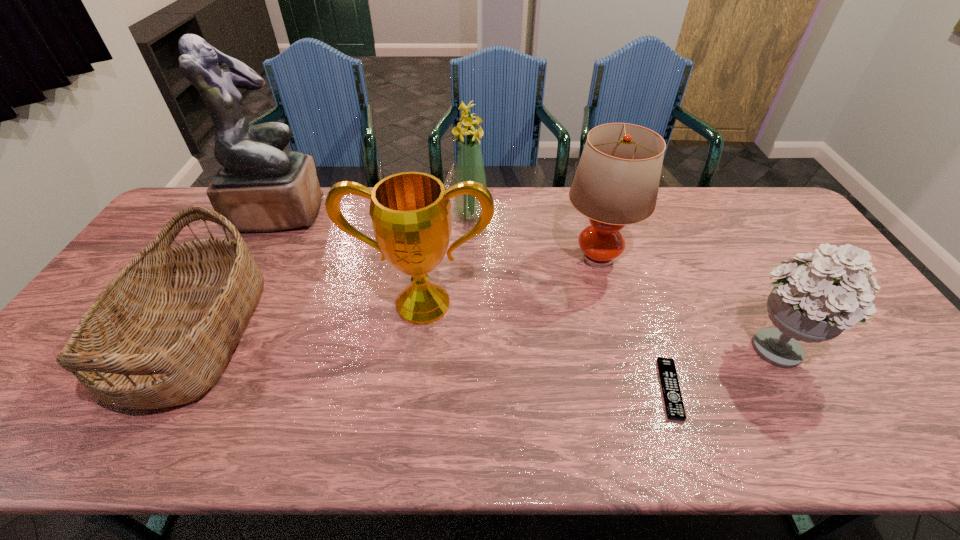
Image resolution: width=960 pixels, height=540 pixels. What are the coordinates of `free space that satisfies the following two spatial constraints: 1. in a relaxed pose on the sculpture; 2. on the right side of the remote control` in the screenshot? It's located at (185, 389).

Locate an element on the screen. Image resolution: width=960 pixels, height=540 pixels. free space that satisfies the following two spatial constraints: 1. on the front-facing side of the taller bouquet; 2. on the left side of the lamp is located at coordinates (469, 258).